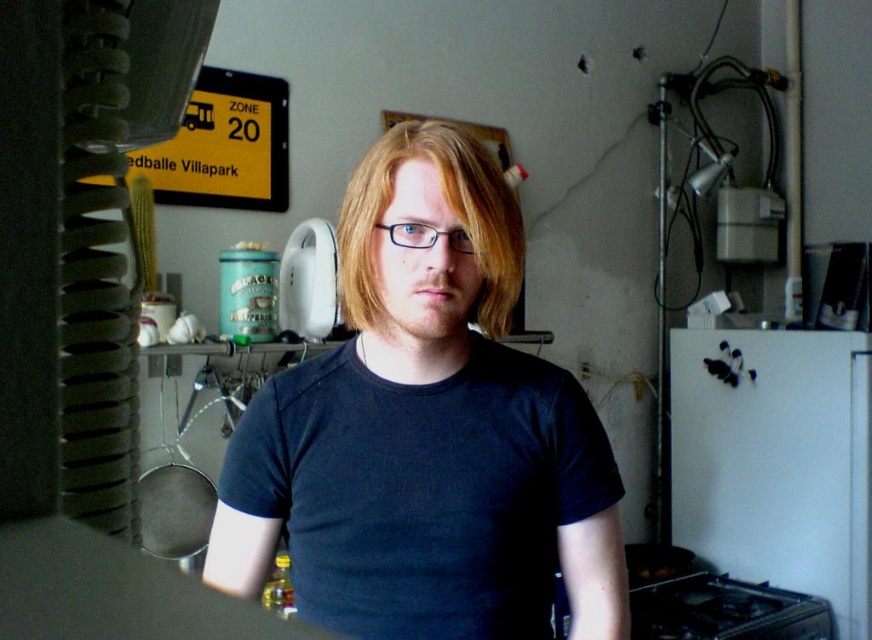
Question: Is the position of dark blue cotton t-shirt at center less distant than that of blondehair at center?

Choices:
 (A) no
 (B) yes

Answer: (A)

Question: Among these objects, which one is farthest from the camera?

Choices:
 (A) dark blue cotton t-shirt at center
 (B) blondehair at center

Answer: (A)

Question: Can you confirm if dark blue cotton t-shirt at center is wider than blondehair at center?

Choices:
 (A) no
 (B) yes

Answer: (B)

Question: Does dark blue cotton t-shirt at center have a greater width compared to blondehair at center?

Choices:
 (A) yes
 (B) no

Answer: (A)